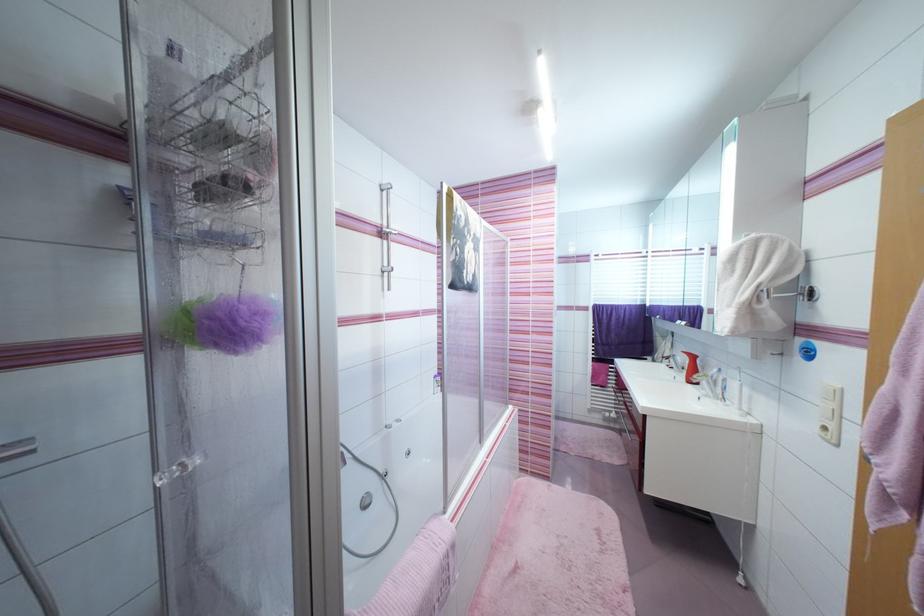
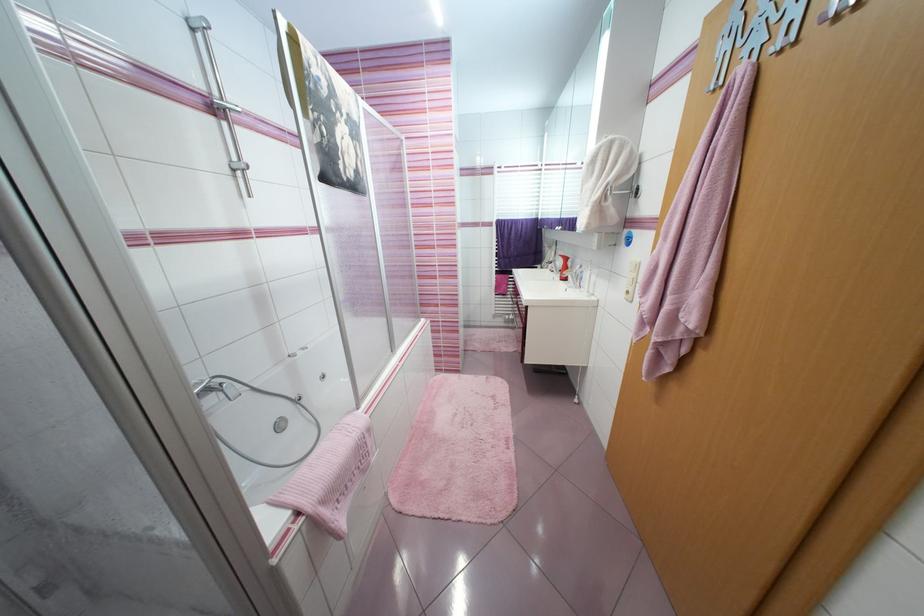
Where in the second image is the point corresponding to the point at 650,297 from the first image?

(543, 211)